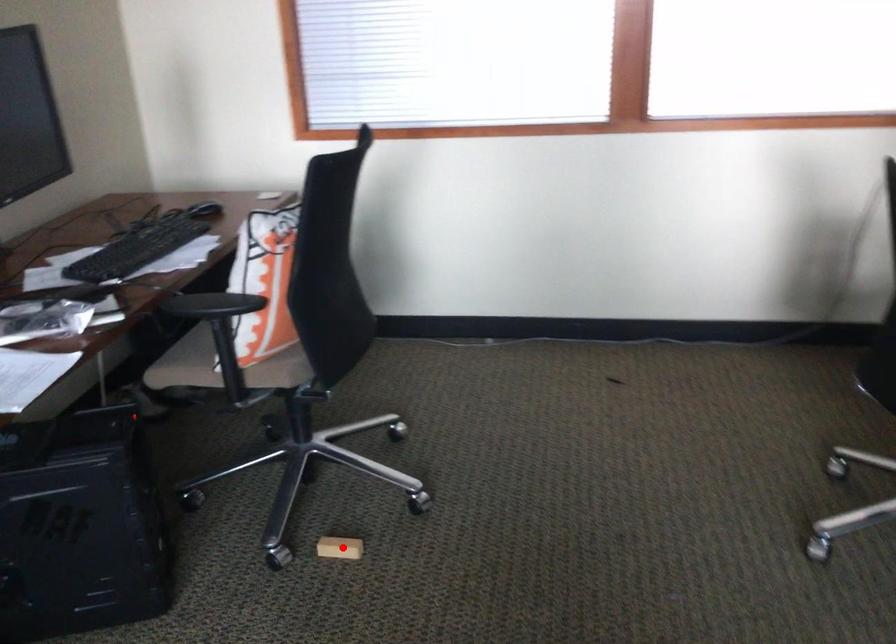
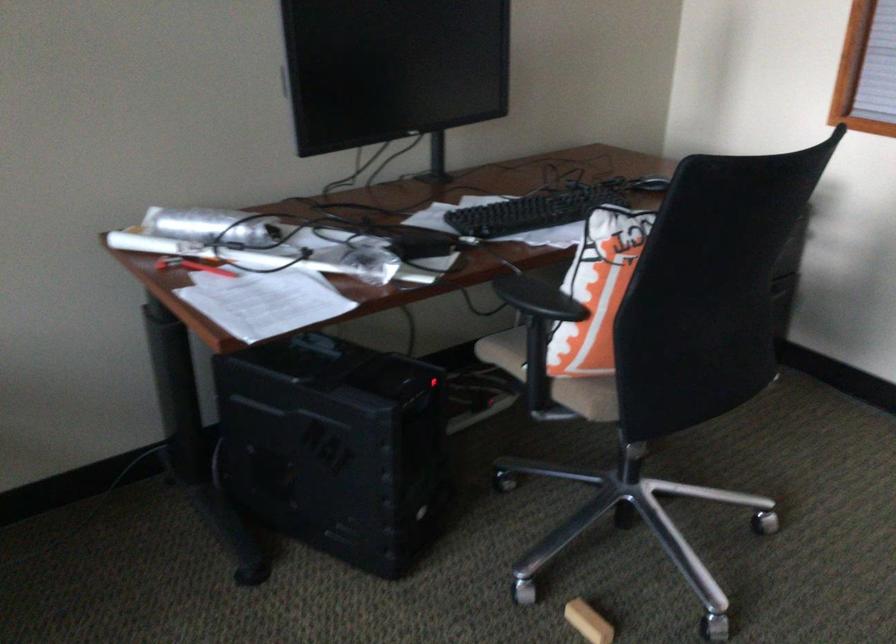
Question: A red point is marked in image1. In image2, is the corresponding 3D point closer to the camera or farther? Reply with the corresponding letter.

Choices:
 (A) The corresponding 3D point is closer.
 (B) The corresponding 3D point is farther.

Answer: (A)